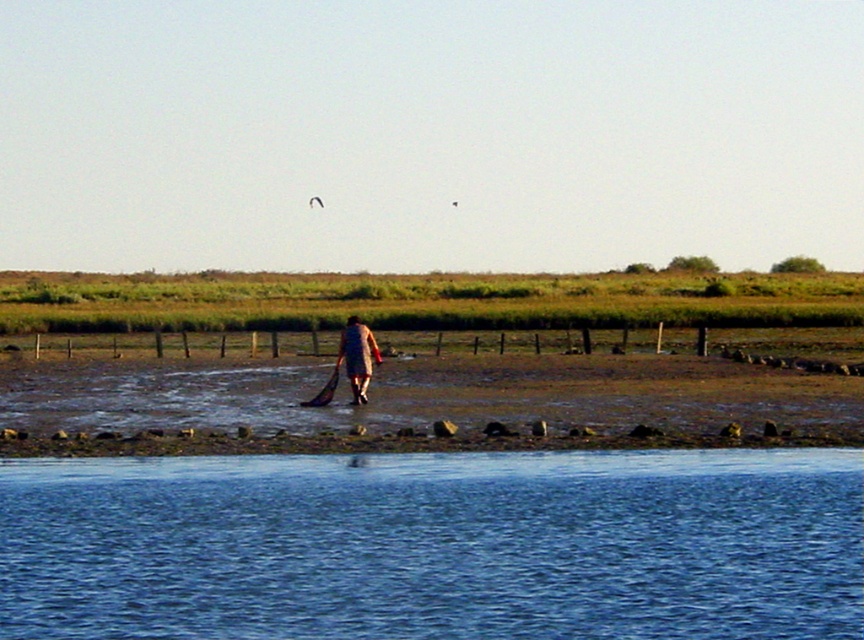
Does blue liquid water at lower center appear on the left side of brown leather jacket at center?

No, blue liquid water at lower center is not to the left of brown leather jacket at center.

Who is more distant from viewer, (87,566) or (347,355)?

The point (347,355) is more distant.

Which is behind, point (727, 582) or point (359, 352)?

The point (359, 352) is behind.

Image resolution: width=864 pixels, height=640 pixels. Identify the location of blue liquid water at lower center. (435, 545).